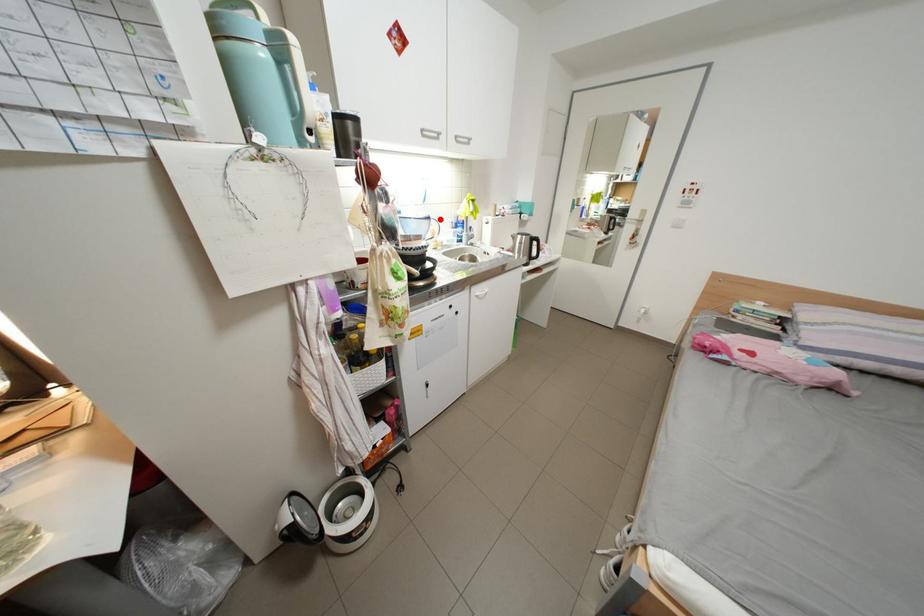
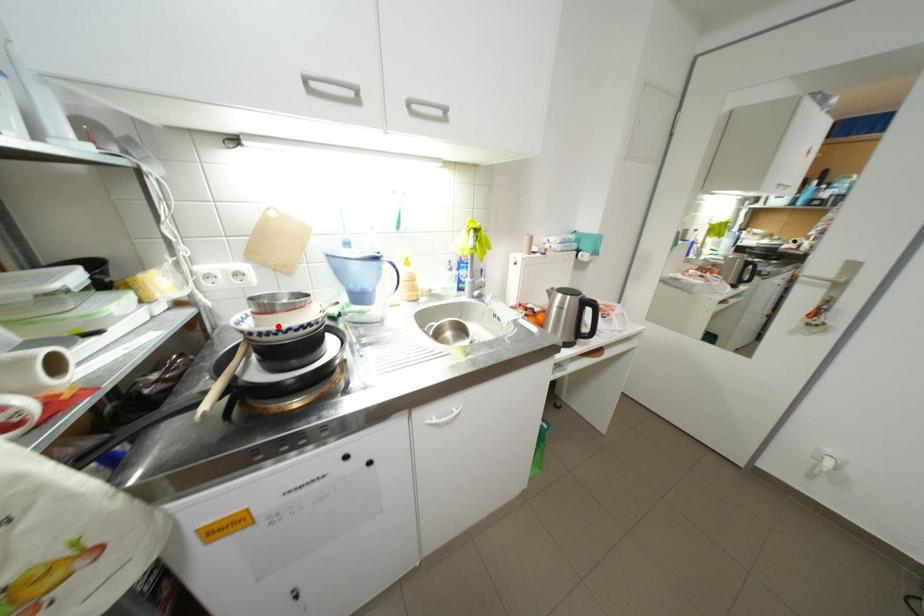
I am providing you with two images of the same scene from different viewpoints. A red point is marked on the first image and another point is marked on the second image. Are the points marked in image1 and image2 representing the same 3D position?

No